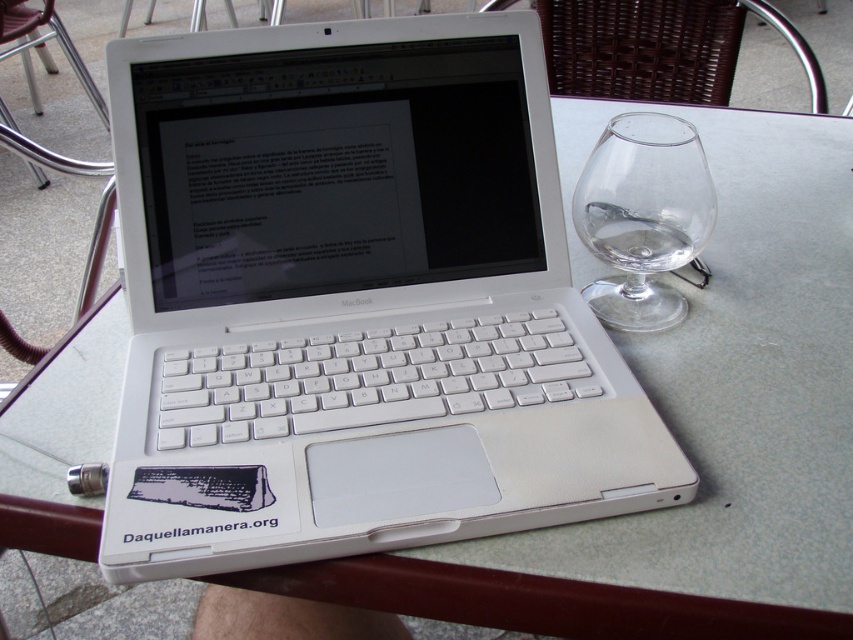
Question: Can you confirm if white plastic laptop at center is smaller than transparent glass wine glass at right?

Choices:
 (A) no
 (B) yes

Answer: (A)

Question: Is white plastic laptop at center positioned before transparent glass wine glass at right?

Choices:
 (A) yes
 (B) no

Answer: (A)

Question: Among these points, which one is nearest to the camera?

Choices:
 (A) (383, 80)
 (B) (659, 324)

Answer: (A)

Question: Which of the following is the farthest from the observer?

Choices:
 (A) (711, 228)
 (B) (236, 433)

Answer: (A)

Question: Can you confirm if white plastic laptop at center is wider than transparent glass wine glass at right?

Choices:
 (A) yes
 (B) no

Answer: (A)

Question: Which object is farther from the camera taking this photo?

Choices:
 (A) transparent glass wine glass at right
 (B) white plastic laptop at center

Answer: (A)